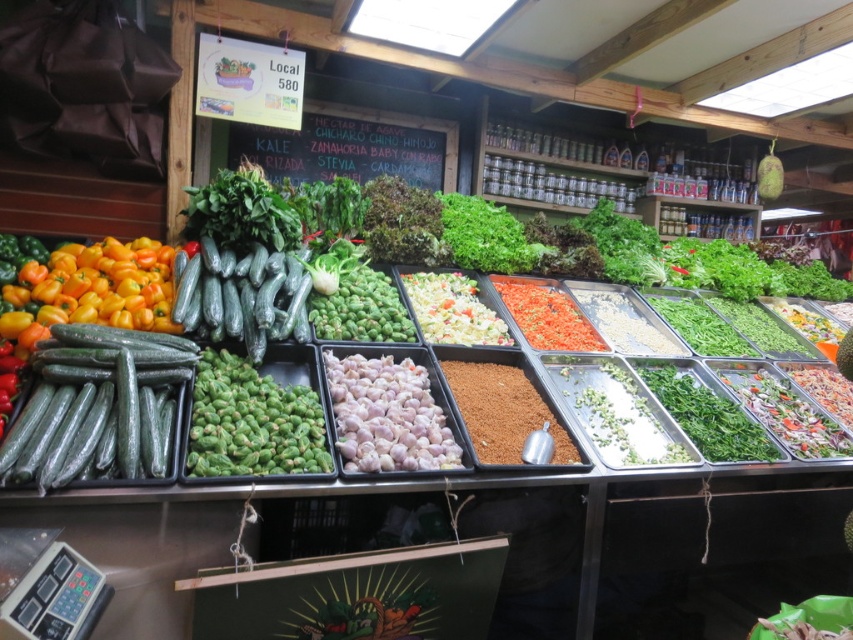
You are a customer at the market stall and want to buy both the green matte cucumbers at center and the bright red dried chili flakes at center. Which one is positioned to the left of the other?

The green matte cucumbers at center are positioned to the left of the bright red dried chili flakes at center.

You are a customer at the market stall looking at the trays of produce. You need to choose between the green matte cucumbers at center and the white crumbly at center for a recipe that requires a wider ingredient. Which one should you pick?

The green matte cucumbers at center might be wider than white crumbly at center, so you should pick the green matte cucumbers at center for your recipe.